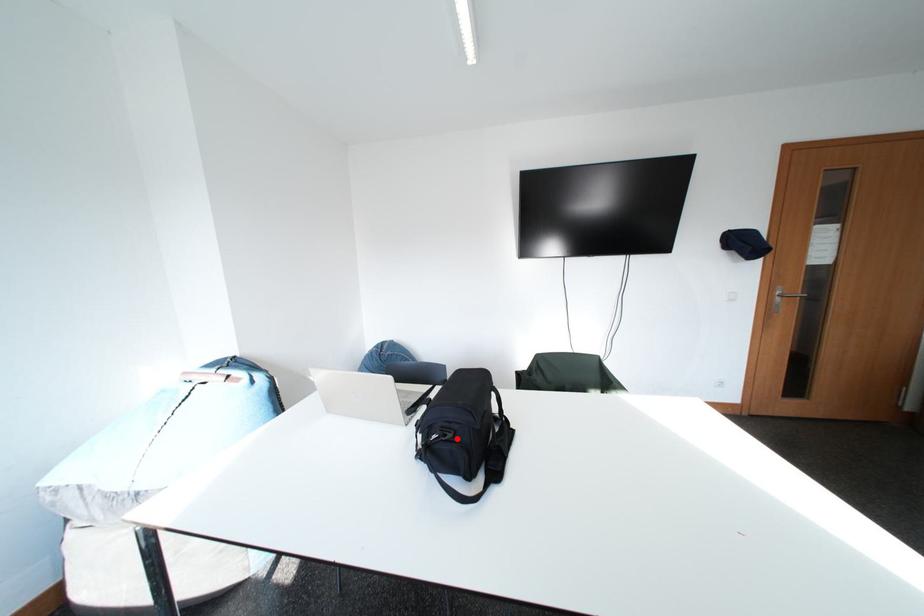
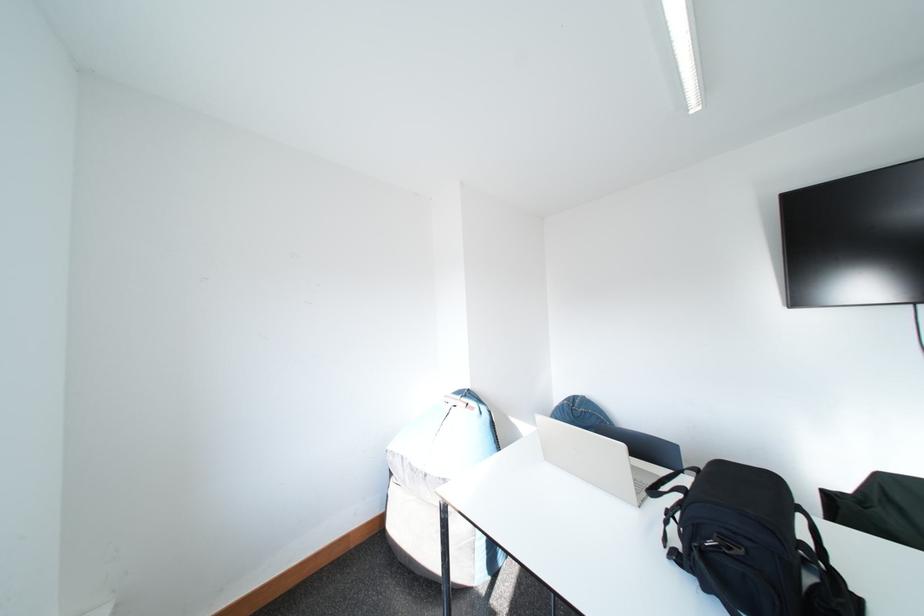
Question: I am providing you with two images of the same scene from different viewpoints. In image1, a red point is highlighted. Considering the same 3D point in image2, which of the following is correct?

Choices:
 (A) It is closer
 (B) It is farther

Answer: (A)